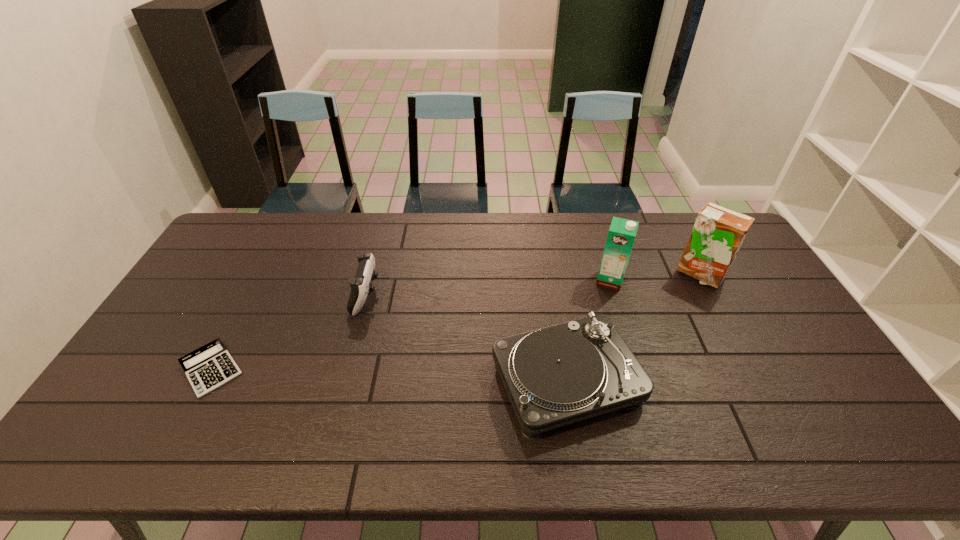
The width and height of the screenshot is (960, 540). Identify the location of vacant region between the right carton and the left carton. (655, 277).

Locate an element on the screen. unoccupied area between the rightmost object and the record player is located at coordinates (633, 328).

Find the location of a particular element. free spot between the rightmost object and the record player is located at coordinates (633, 328).

Locate an element on the screen. This screenshot has width=960, height=540. free space between the rightmost object and the shortest object is located at coordinates (455, 321).

Locate an element on the screen. This screenshot has width=960, height=540. vacant space that is in between the control and the record player is located at coordinates (467, 338).

The height and width of the screenshot is (540, 960). In order to click on empty space that is in between the right carton and the left carton in this screenshot , I will do click(x=655, y=277).

The height and width of the screenshot is (540, 960). I want to click on free area in between the record player and the rightmost object, so click(633, 328).

Locate an element on the screen. Image resolution: width=960 pixels, height=540 pixels. vacant point located between the record player and the calculator is located at coordinates (389, 375).

Where is `object that stands as the third closest to the rightmost object`? object that stands as the third closest to the rightmost object is located at coordinates (361, 286).

Select which object appears as the third closest to the leftmost object. Please provide its 2D coordinates. Your answer should be formatted as a tuple, i.e. [(x, y)], where the tuple contains the x and y coordinates of a point satisfying the conditions above.

[(622, 232)]